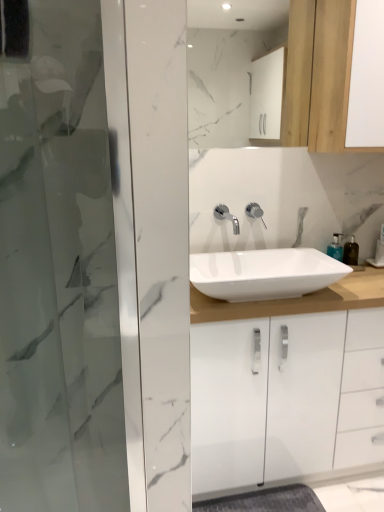
At what (x,y) coordinates should I click in order to perform the action: click on translucent plastic soap dispenser at right, which is counted as the second soap dispenser, starting from the right. Please return your answer as a coordinate pair (x, y). Looking at the image, I should click on (335, 247).

Describe the element at coordinates (227, 64) in the screenshot. Image resolution: width=384 pixels, height=512 pixels. I see `white marble mirror at upper center` at that location.

In order to face translucent amber bottle at right, the 1th soap dispenser positioned from the right, should I rotate leftwards or rightwards?

A: Rotate right and turn 20.642 degrees.

Describe the element at coordinates (351, 251) in the screenshot. I see `translucent amber bottle at right, positioned as the second soap dispenser in left-to-right order` at that location.

Image resolution: width=384 pixels, height=512 pixels. I want to click on polished chrome faucet at center, arranged as the 1th tap when viewed from the right, so click(x=255, y=212).

This screenshot has height=512, width=384. What are the coordinates of `translucent plastic soap dispenser at right, which is counted as the second soap dispenser, starting from the right` in the screenshot? It's located at (335, 247).

Considering the sizes of objects translucent plastic soap dispenser at right, the first soap dispenser positioned from the left, and white glossy sink at center in the image provided, who is taller, translucent plastic soap dispenser at right, the first soap dispenser positioned from the left, or white glossy sink at center?

With more height is translucent plastic soap dispenser at right, the first soap dispenser positioned from the left.

Which object is more forward, translucent plastic soap dispenser at right, the first soap dispenser positioned from the left, or white glossy sink at center?

white glossy sink at center is in front.

Is translucent plastic soap dispenser at right, which is counted as the second soap dispenser, starting from the right, bigger or smaller than white glossy sink at center?

In the image, translucent plastic soap dispenser at right, which is counted as the second soap dispenser, starting from the right, appears to be smaller than white glossy sink at center.

Are translucent plastic soap dispenser at right, the first soap dispenser positioned from the left, and white glossy sink at center far apart?

No, there isn't a large distance between translucent plastic soap dispenser at right, the first soap dispenser positioned from the left, and white glossy sink at center.

Considering the relative positions of white glossy sink at center and translucent plastic soap dispenser at right, the first soap dispenser positioned from the left, in the image provided, is white glossy sink at center in front of translucent plastic soap dispenser at right, the first soap dispenser positioned from the left,?

Yes, it is.

In the scene shown: From the image's perspective, would you say white glossy sink at center is shown under translucent plastic soap dispenser at right, which is counted as the second soap dispenser, starting from the right?

Yes, from the image's perspective, white glossy sink at center is below translucent plastic soap dispenser at right, which is counted as the second soap dispenser, starting from the right.

Can you confirm if white glossy sink at center is smaller than translucent plastic soap dispenser at right, the first soap dispenser positioned from the left?

Actually, white glossy sink at center might be larger than translucent plastic soap dispenser at right, the first soap dispenser positioned from the left.

From a real-world perspective, which soap dispenser is the 2nd one above the white glossy sink at center? Please provide its 2D coordinates.

[(335, 247)]

Is white marble mirror at upper center in contact with polished chrome faucet at center, which appears as the second tap when viewed from the left?

No, white marble mirror at upper center is not making contact with polished chrome faucet at center, which appears as the second tap when viewed from the left.

From the picture: Is white marble mirror at upper center not inside polished chrome faucet at center, which appears as the second tap when viewed from the left?

Yes, white marble mirror at upper center is outside of polished chrome faucet at center, which appears as the second tap when viewed from the left.

Does white marble mirror at upper center have a greater width compared to polished chrome faucet at center, which appears as the second tap when viewed from the left?

Incorrect, the width of white marble mirror at upper center does not surpass that of polished chrome faucet at center, which appears as the second tap when viewed from the left.

What's the angular difference between wooden cabinet at upper right and translucent plastic soap dispenser at right, which is counted as the second soap dispenser, starting from the right,'s facing directions?

wooden cabinet at upper right and translucent plastic soap dispenser at right, which is counted as the second soap dispenser, starting from the right, are facing 4.52 degrees away from each other.

Is wooden cabinet at upper right spatially inside translucent plastic soap dispenser at right, which is counted as the second soap dispenser, starting from the right, or outside of it?

The correct answer is: outside.

From the image's perspective, is wooden cabinet at upper right above or below translucent plastic soap dispenser at right, the first soap dispenser positioned from the left?

Clearly, from the image's perspective, wooden cabinet at upper right is above translucent plastic soap dispenser at right, the first soap dispenser positioned from the left.

From a real-world perspective, which is physically above, wooden cabinet at upper right or translucent plastic soap dispenser at right, which is counted as the second soap dispenser, starting from the right?

In real-world perspective, wooden cabinet at upper right is above.

From the image's perspective, is transparent glass screen door at left above or below polished chrome faucet at center, the first tap from the left?

Clearly, from the image's perspective, transparent glass screen door at left is below polished chrome faucet at center, the first tap from the left.

Between transparent glass screen door at left and polished chrome faucet at center, which ranks as the second tap in right-to-left order, which one appears on the right side from the viewer's perspective?

polished chrome faucet at center, which ranks as the second tap in right-to-left order.

Is transparent glass screen door at left looking in the opposite direction of polished chrome faucet at center, which ranks as the second tap in right-to-left order?

transparent glass screen door at left does not have its back to polished chrome faucet at center, which ranks as the second tap in right-to-left order.

Considering the positions of objects transparent glass screen door at left and polished chrome faucet at center, which ranks as the second tap in right-to-left order, in the image provided, who is behind, transparent glass screen door at left or polished chrome faucet at center, which ranks as the second tap in right-to-left order,?

Positioned behind is polished chrome faucet at center, which ranks as the second tap in right-to-left order.

Who is taller, wooden cabinet at upper right or transparent glass screen door at left?

transparent glass screen door at left.

Considering the sizes of objects wooden cabinet at upper right and transparent glass screen door at left in the image provided, who is smaller, wooden cabinet at upper right or transparent glass screen door at left?

transparent glass screen door at left is smaller.

Considering the sizes of wooden cabinet at upper right and transparent glass screen door at left in the image, is wooden cabinet at upper right wider or thinner than transparent glass screen door at left?

Clearly, wooden cabinet at upper right has more width compared to transparent glass screen door at left.

Does polished chrome faucet at center, the first tap from the left, appear on the left side of translucent amber bottle at right, the 1th soap dispenser positioned from the right?

Yes.

Could you tell me if polished chrome faucet at center, which ranks as the second tap in right-to-left order, is turned towards translucent amber bottle at right, the 1th soap dispenser positioned from the right?

No, polished chrome faucet at center, which ranks as the second tap in right-to-left order, is not oriented towards translucent amber bottle at right, the 1th soap dispenser positioned from the right.

Measure the distance from polished chrome faucet at center, the first tap from the left, to translucent amber bottle at right, positioned as the second soap dispenser in left-to-right order.

21.14 inches.

Which is behind, point (220, 214) or point (344, 257)?

Point (344, 257)

From the white glossy sink at center, count 1st soap dispenser to the right and point to it. Please provide its 2D coordinates.

[(335, 247)]

Where is `soap dispenser that is the 1st one when counting backward from the white glossy sink at center`? This screenshot has height=512, width=384. soap dispenser that is the 1st one when counting backward from the white glossy sink at center is located at coordinates (335, 247).

Which object lies further to the anchor point white marble mirror at upper center, polished chrome faucet at center, the first tap from the left, or wooden cabinet at upper right?

polished chrome faucet at center, the first tap from the left, is positioned further to the anchor white marble mirror at upper center.

Which object lies further to the anchor point wooden cabinet at upper right, polished chrome faucet at center, arranged as the 1th tap when viewed from the right, or transparent glass screen door at left?

transparent glass screen door at left is further to wooden cabinet at upper right.

Looking at the image, which one is located closer to translucent plastic soap dispenser at right, the first soap dispenser positioned from the left, wooden cabinet at upper right or transparent glass screen door at left?

Among the two, wooden cabinet at upper right is located nearer to translucent plastic soap dispenser at right, the first soap dispenser positioned from the left.

When comparing their distances from wooden cabinet at upper right, does translucent amber bottle at right, the 1th soap dispenser positioned from the right, or white marble mirror at upper center seem further?

white marble mirror at upper center lies further to wooden cabinet at upper right than the other object.

Based on their spatial positions, is polished chrome faucet at center, which appears as the second tap when viewed from the left, or translucent amber bottle at right, positioned as the second soap dispenser in left-to-right order, further from translucent plastic soap dispenser at right, which is counted as the second soap dispenser, starting from the right?

polished chrome faucet at center, which appears as the second tap when viewed from the left.

Considering their positions, is transparent glass screen door at left positioned closer to white glossy sink at center than translucent amber bottle at right, the 1th soap dispenser positioned from the right?

Based on the image, translucent amber bottle at right, the 1th soap dispenser positioned from the right, appears to be nearer to white glossy sink at center.

Looking at the image, which one is located further to translucent plastic soap dispenser at right, which is counted as the second soap dispenser, starting from the right, translucent amber bottle at right, positioned as the second soap dispenser in left-to-right order, or polished chrome faucet at center, arranged as the 1th tap when viewed from the right?

polished chrome faucet at center, arranged as the 1th tap when viewed from the right, is further to translucent plastic soap dispenser at right, which is counted as the second soap dispenser, starting from the right.

Based on their spatial positions, is polished chrome faucet at center, which appears as the second tap when viewed from the left, or white marble mirror at upper center further from wooden cabinet at upper right?

white marble mirror at upper center.

This screenshot has height=512, width=384. What are the coordinates of `cabinetry between white marble mirror at upper center and polished chrome faucet at center, arranged as the 1th tap when viewed from the right, in the up-down direction` in the screenshot? It's located at (332, 77).

The height and width of the screenshot is (512, 384). I want to click on tap positioned between transparent glass screen door at left and polished chrome faucet at center, which appears as the second tap when viewed from the left, from near to far, so click(x=227, y=217).

Identify the location of cabinetry between white marble mirror at upper center and translucent plastic soap dispenser at right, which is counted as the second soap dispenser, starting from the right, in the vertical direction. (332, 77).

Identify the location of soap dispenser located between polished chrome faucet at center, which ranks as the second tap in right-to-left order, and translucent amber bottle at right, positioned as the second soap dispenser in left-to-right order, in the left-right direction. (335, 247).